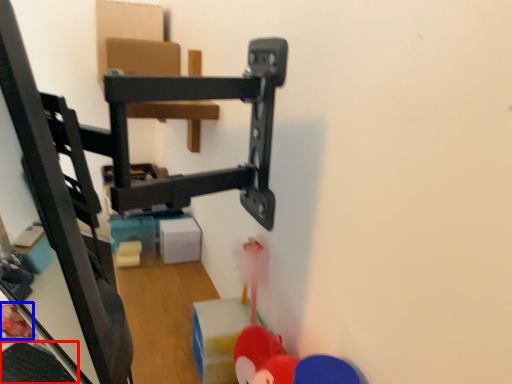
Question: Which object appears farthest to the camera in this image, keyboard (highlighted by a red box) or toy (highlighted by a blue box)?

Choices:
 (A) keyboard
 (B) toy

Answer: (B)